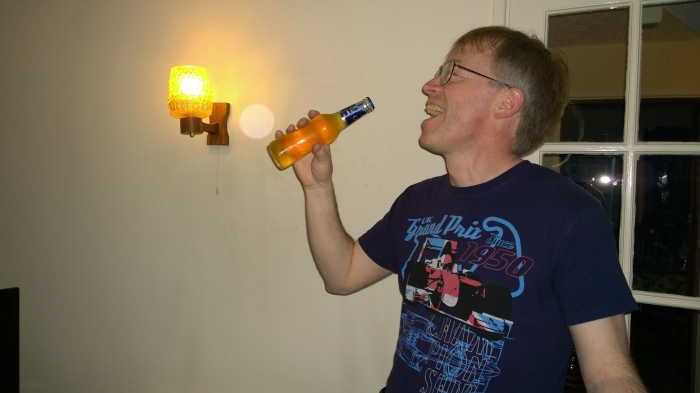
Identify the location of white circle on wall. (253, 123).